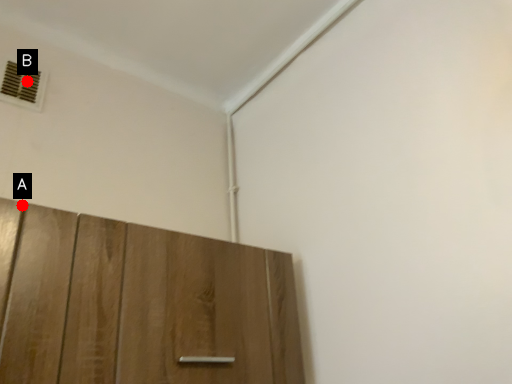
Question: Two points are circled on the image, labeled by A and B beside each circle. Which point is closer to the camera?

Choices:
 (A) A is closer
 (B) B is closer

Answer: (A)